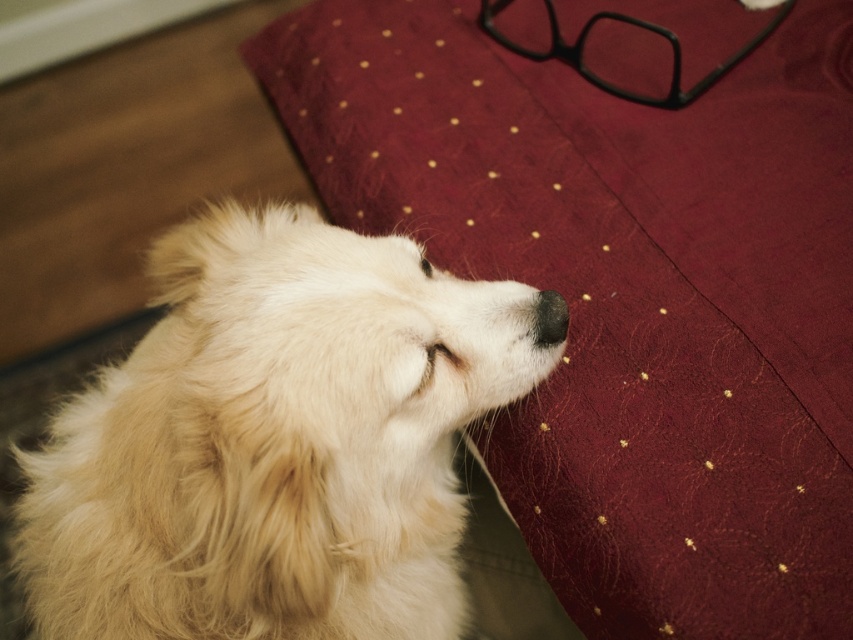
You are a photographer wanting to capture the fluffy white dog at center and the burgundy textured blanket at upper right in a portrait. Since you want the dog to be the main focus, which object should you place closer to the camera to ensure it appears larger in the photo?

To make the fluffy white dog at center appear larger in the photo, you should position it closer to the camera. However, according to the description, the burgundy textured blanket at upper right is taller than the dog. To emphasize the dog as the main focus, you might need to adjust their positions so the dog is closer, even though the blanket is taller in the current setup.

You are holding a 24 inch ruler and want to measure the distance from the camera to the point at coordinates point (397, 381). Can you reach it with your ruler?

The distance of point (397, 381) from camera is 28.10 inches, so the ruler is 24 inches which is shorter than the required distance. You cannot reach it with your ruler.

You are a photographer trying to capture the black matte nose at center and the burgundy textured blanket at upper right in a single frame. Since the camera can only focus on objects within a 10 cm height difference, can you ensure both are in focus?

The burgundy textured blanket at upper right has a greater height compared to the black matte nose at center. Since the height difference is not specified, but the camera requires objects within 10 cm of each other vertically to be in focus, it is possible if their vertical separation is under 10 cm. However, without exact measurements, we cannot confirm definitively.